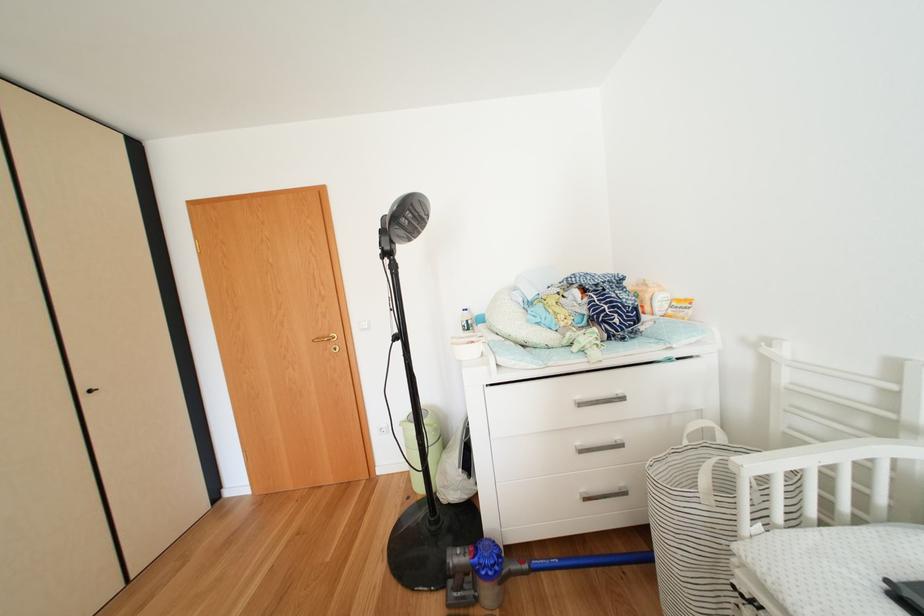
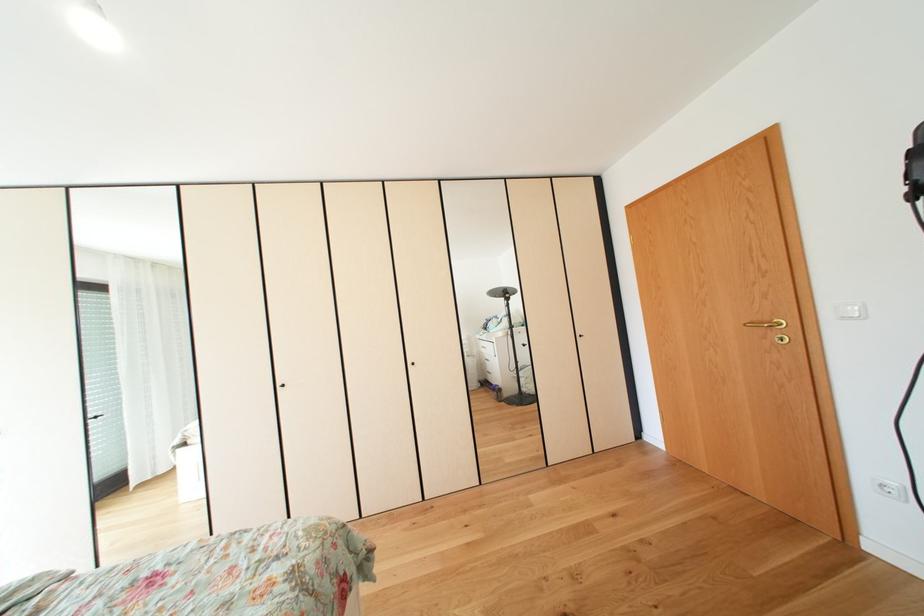
Question: The images are taken continuously from a first-person perspective. In which direction is your viewpoint rotating?

Choices:
 (A) Left
 (B) Right
 (C) Up
 (D) Down

Answer: (A)